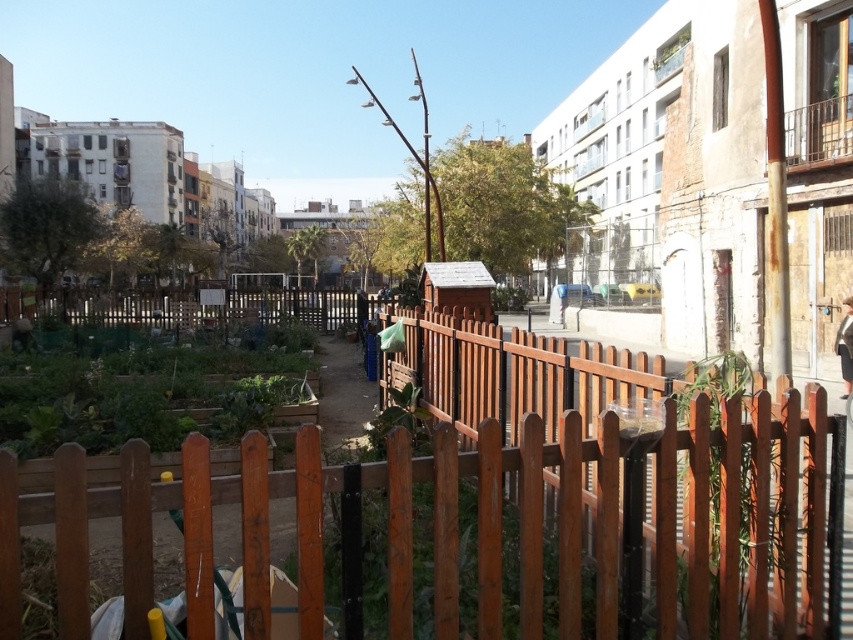
Question: Is brown wooden fence at center to the left of green matte vegetable garden at lower left from the viewer's perspective?

Choices:
 (A) no
 (B) yes

Answer: (A)

Question: Which point appears farthest from the camera in this image?

Choices:
 (A) (148, 356)
 (B) (749, 444)

Answer: (A)

Question: Is brown wooden fence at center smaller than green matte vegetable garden at lower left?

Choices:
 (A) no
 (B) yes

Answer: (B)

Question: Observing the image, what is the correct spatial positioning of brown wooden fence at center in reference to green matte vegetable garden at lower left?

Choices:
 (A) left
 (B) right

Answer: (B)